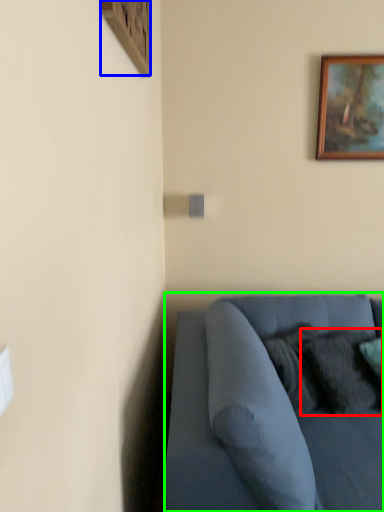
Question: Which object is the closest to the pillow (highlighted by a red box)? Choose among these: picture frame (highlighted by a blue box) or studio couch (highlighted by a green box).

Choices:
 (A) picture frame
 (B) studio couch

Answer: (B)